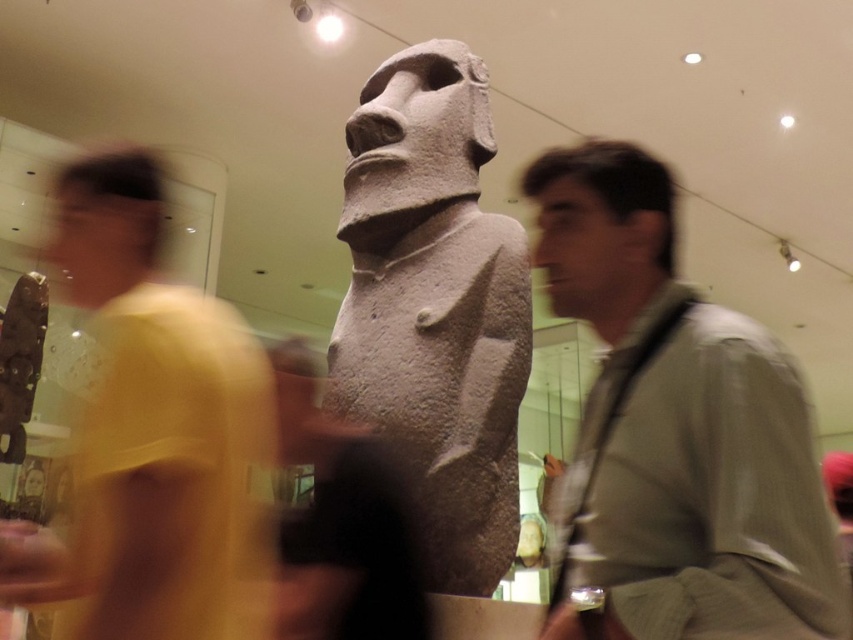
You are a tour guide explaining the statue to visitors. You notice the light brown leather jacket at center and the yellow matte shirt at left. Which visitor is standing closer to the statue?

A: The light brown leather jacket at center is positioned over the yellow matte shirt at left, meaning the light brown leather jacket at center is closer to the statue.

You are a tour guide explaining the statue to visitors. A visitor asks if the yellow matte shirt at left is closer to the entrance than the gray stone statue at center. Based on the scene, how would you respond?

The yellow matte shirt at left is positioned under the gray stone statue at center, which means it is closer to the entrance than the statue.

In the scene shown: You are an art curator planning to move the light brown leather jacket at center and the gray stone statue at center to a new exhibition space. The entrance door to the new space is 1.2 meters wide. Can both items pass through the door without rotating them?

The light brown leather jacket at center is wider than the gray stone statue at center. Since the door is 1.2 meters wide, both items can pass through the door as long as their widths are less than 1.2 meters. However, without specific measurements, it is impossible to determine definitively.